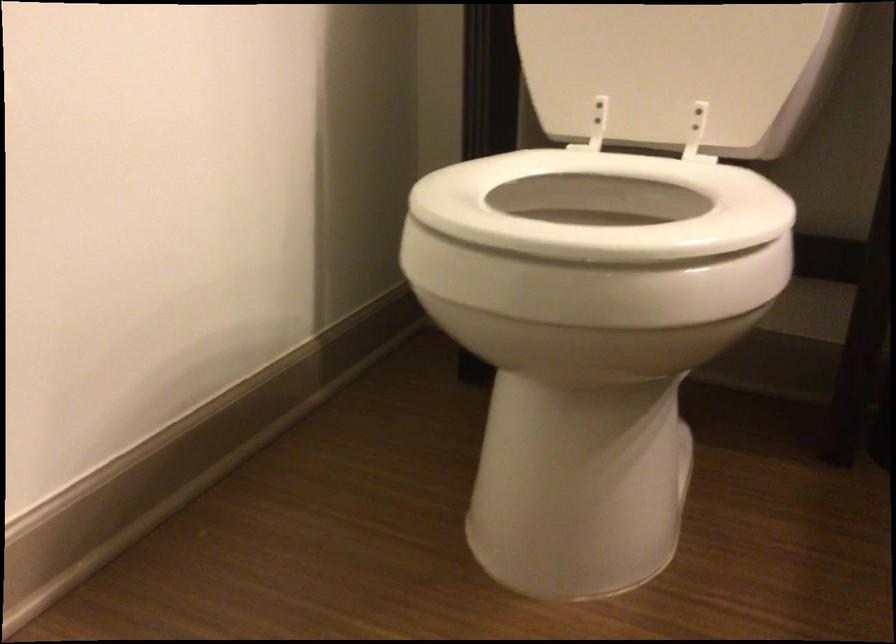
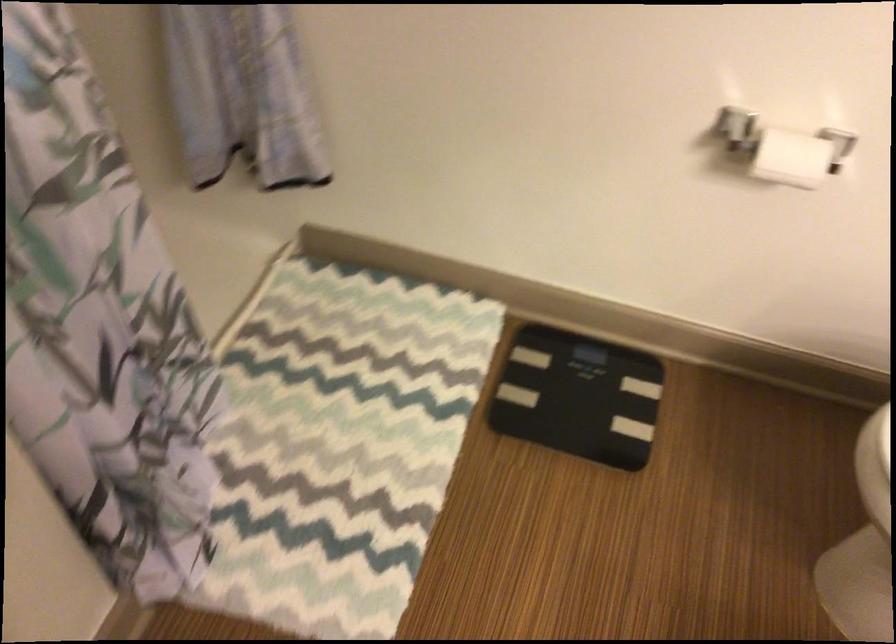
First-person continuous shooting, in which direction is the camera rotating?

The camera's rotation is toward left-down.